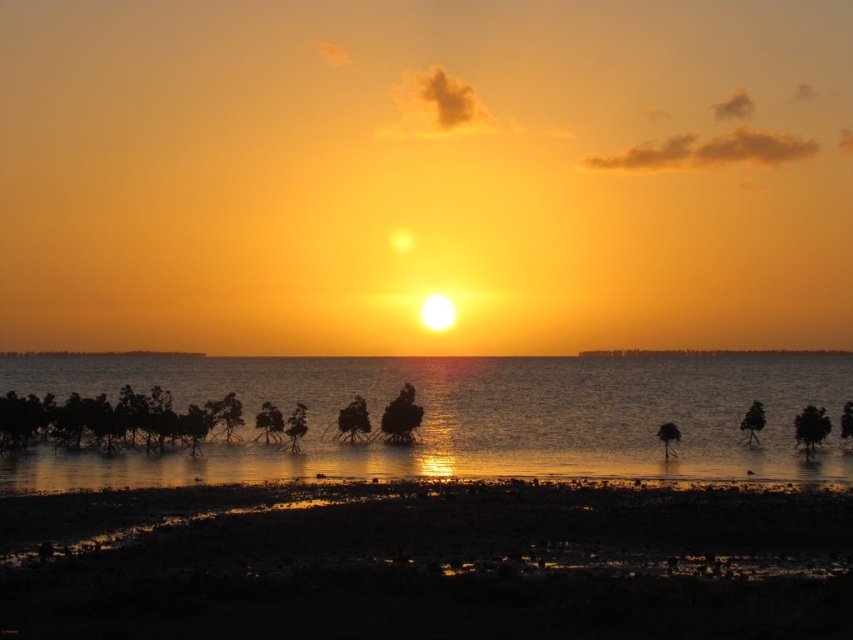
Question: Where is damp sand at lower center located in relation to silvery reflective water at center in the image?

Choices:
 (A) above
 (B) below

Answer: (A)

Question: Is damp sand at lower center in front of silvery reflective water at center?

Choices:
 (A) no
 (B) yes

Answer: (B)

Question: Which point is closer to the camera taking this photo?

Choices:
 (A) (457, 440)
 (B) (403, 516)

Answer: (B)

Question: Is damp sand at lower center below silvery reflective water at center?

Choices:
 (A) no
 (B) yes

Answer: (A)